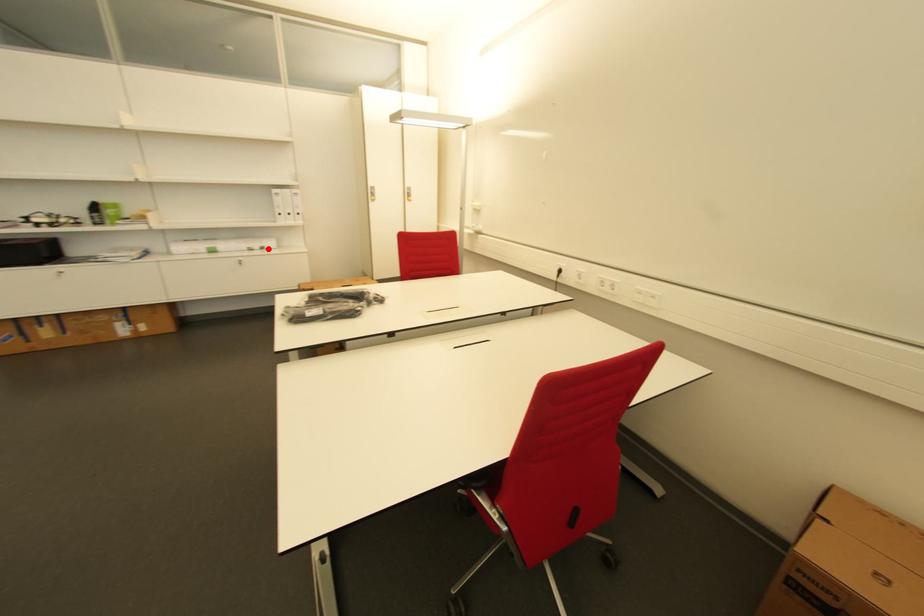
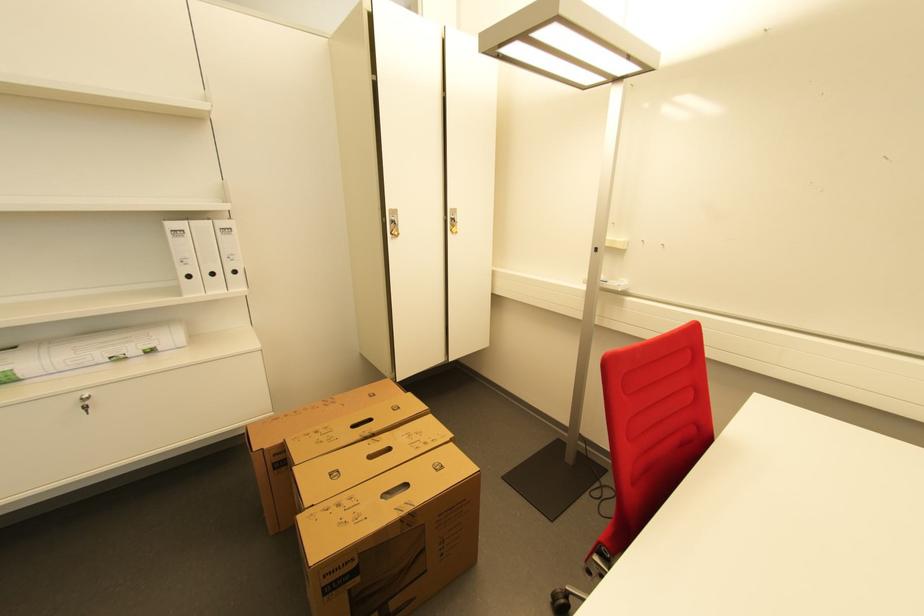
In the second image, find the point that corresponds to the highlighted location in the first image.

(155, 352)